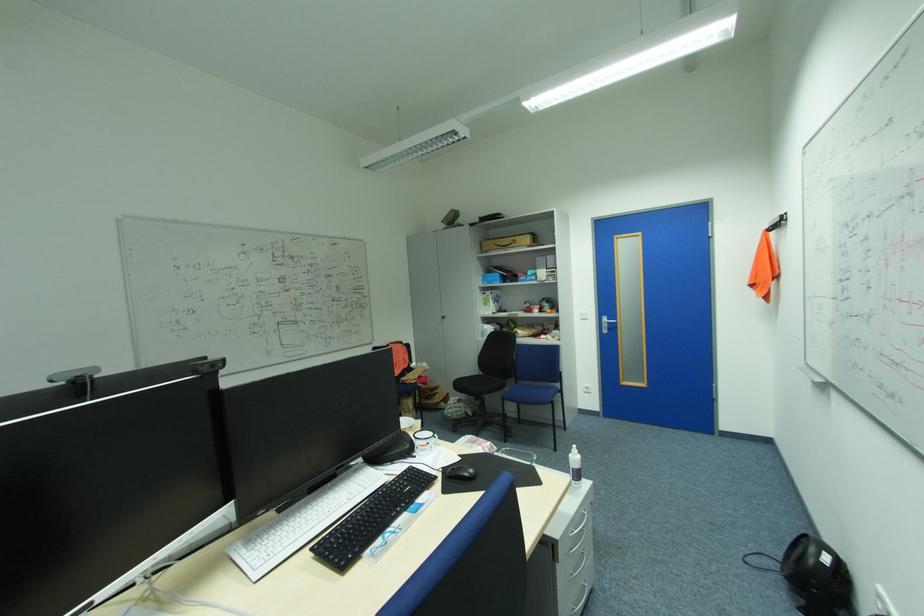
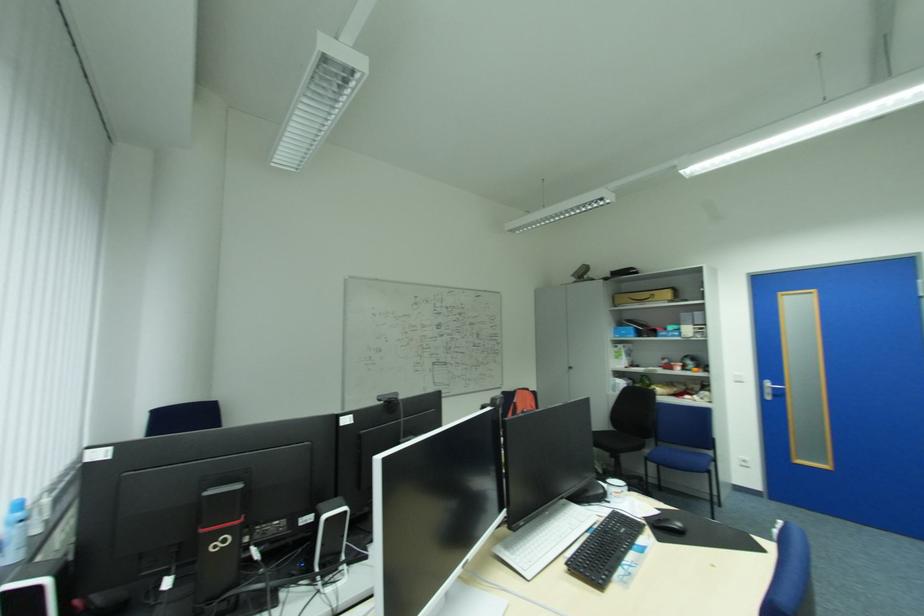
In the second image, find the point that corresponds to point (521, 240) in the first image.

(659, 294)